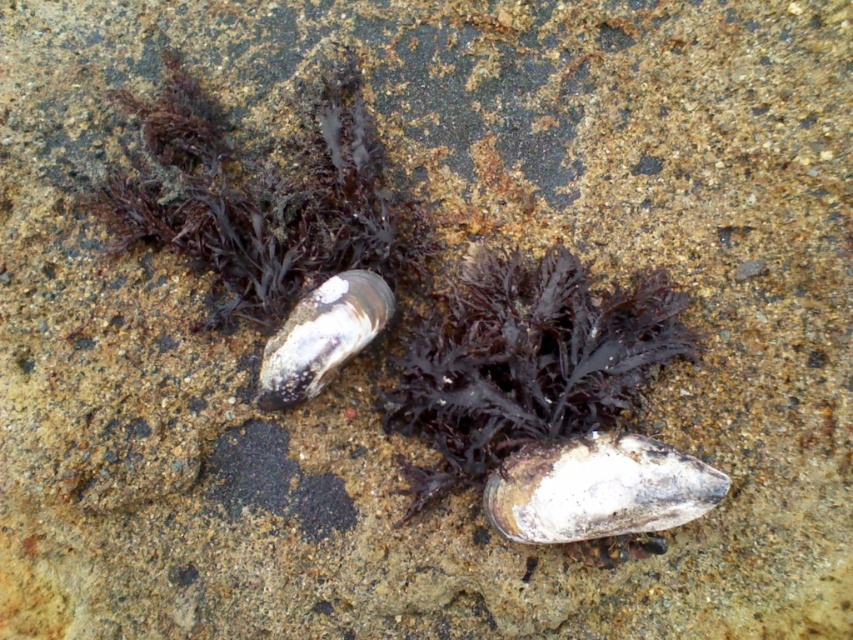
Question: Estimate the real-world distances between objects in this image. Which object is closer to the white glossy oyster at center?

Choices:
 (A) dark matte seaweed at center
 (B) white matte oyster at center

Answer: (A)

Question: Observing the image, what is the correct spatial positioning of dark matte seaweed at center in reference to white glossy oyster at center?

Choices:
 (A) below
 (B) above

Answer: (A)

Question: Which object is farther from the camera taking this photo?

Choices:
 (A) white matte oyster at center
 (B) dark matte seaweed at center
 (C) white glossy oyster at center

Answer: (B)

Question: Can you confirm if dark matte seaweed at center is wider than white matte oyster at center?

Choices:
 (A) yes
 (B) no

Answer: (A)

Question: Does dark matte seaweed at center have a lesser width compared to white glossy oyster at center?

Choices:
 (A) no
 (B) yes

Answer: (A)

Question: Among these points, which one is nearest to the camera?

Choices:
 (A) (303, 314)
 (B) (621, 499)

Answer: (B)